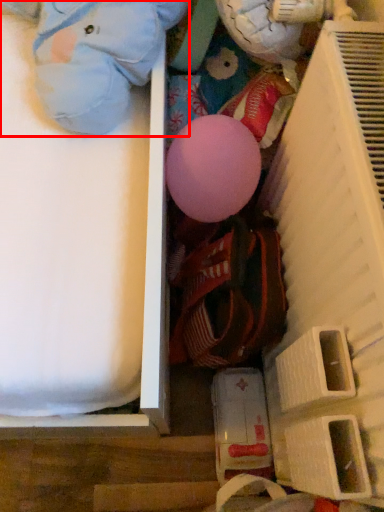
Question: From the image's perspective, where is toy (annotated by the red box) located in relation to shelf in the image?

Choices:
 (A) above
 (B) below

Answer: (A)